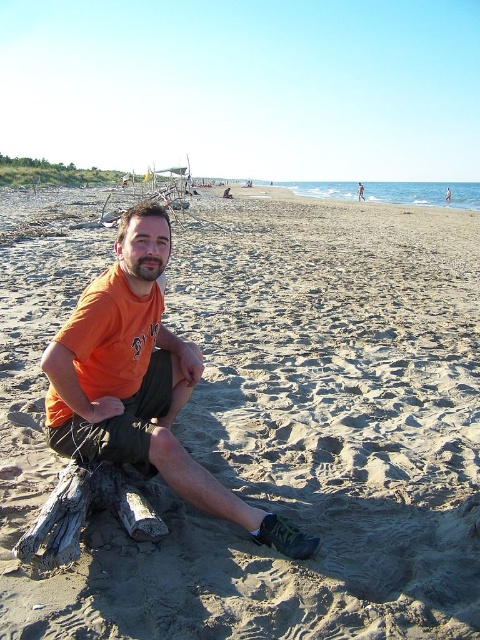
You are a photographer trying to capture the driftwood in the scene. You notice two logs in the image. Which one is positioned higher up in the frame, the sandytexturelog at left or the gray weathered wood log at lower left?

The sandytexturelog at left is positioned higher up in the frame compared to the gray weathered wood log at lower left.